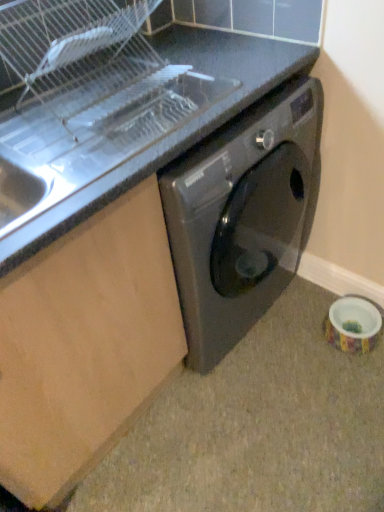
In order to click on free space above matte gray granite at lower right (from a real-world perspective) in this screenshot , I will do `click(257, 409)`.